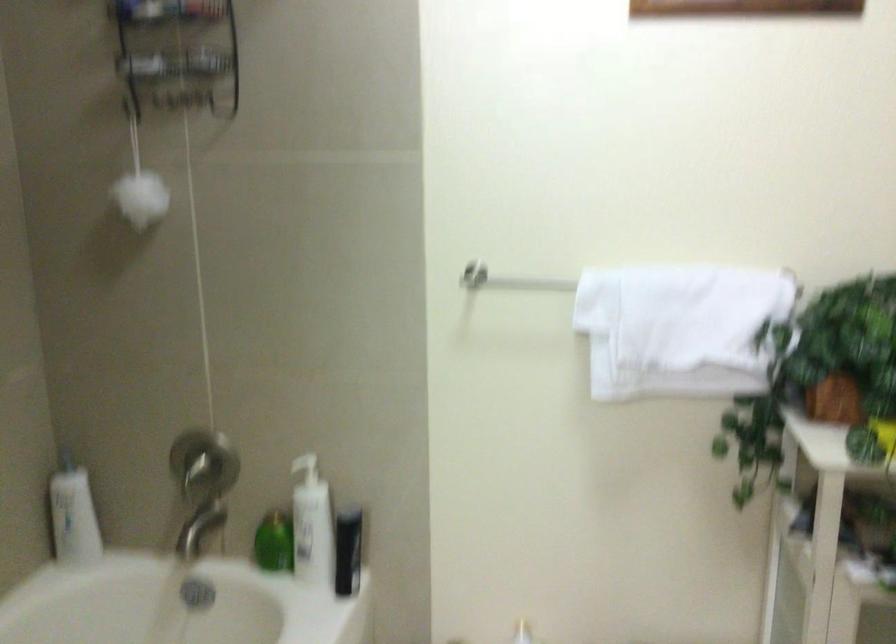
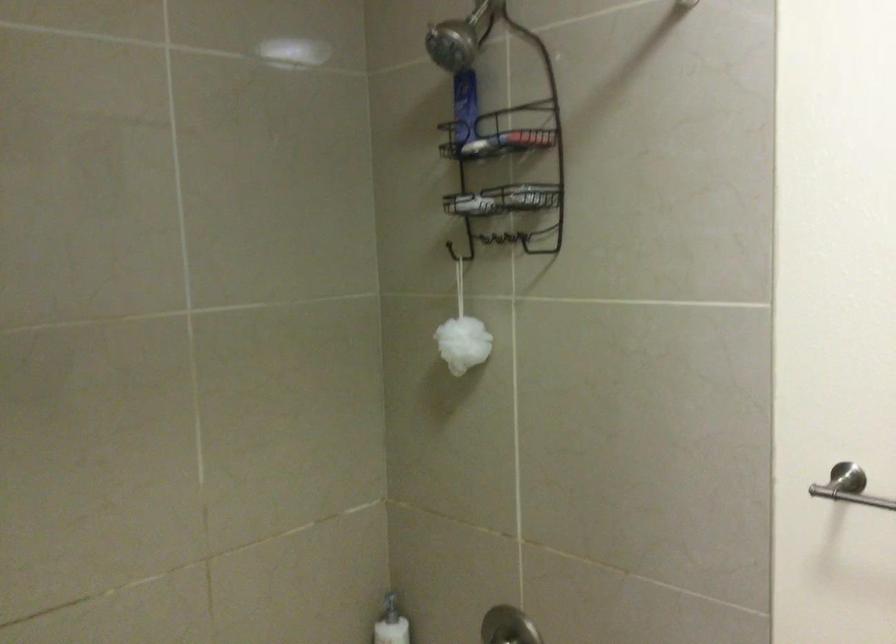
Where in the second image is the point corresponding to the point at 202,446 from the first image?

(506, 627)